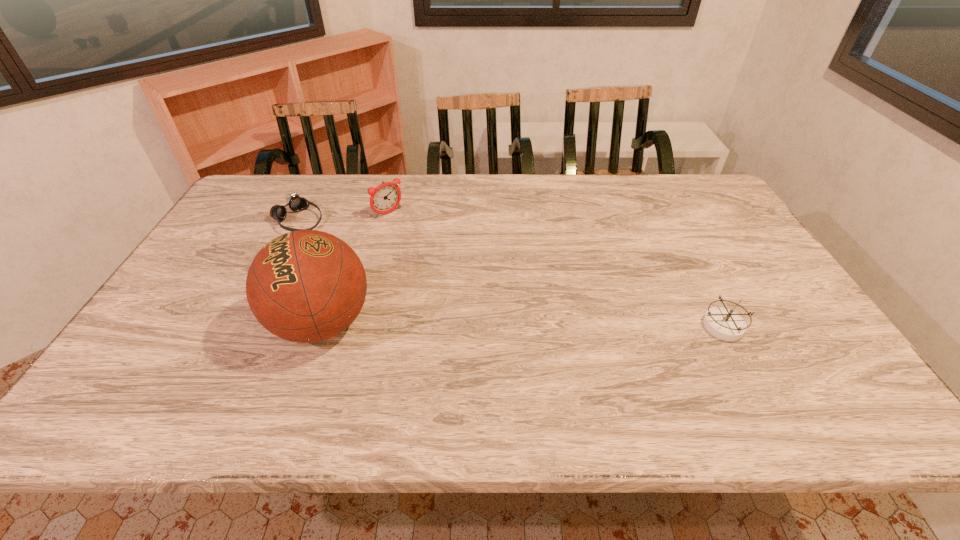
The image size is (960, 540). What are the coordinates of `the tallest object` in the screenshot? It's located at (305, 286).

Where is `compass`? compass is located at coordinates (724, 323).

Image resolution: width=960 pixels, height=540 pixels. Find the location of `the second tallest object`. the second tallest object is located at coordinates (384, 198).

Locate an element on the screen. This screenshot has height=540, width=960. goggles is located at coordinates (296, 203).

I want to click on free spot located on the right of the tallest object, so click(x=470, y=323).

This screenshot has height=540, width=960. I want to click on free space located 0.230m on the back of the compass, so click(684, 251).

Identify the location of free space located 0.380m on the front-facing side of the alarm clock. (467, 282).

At what (x,y) coordinates should I click in order to perform the action: click on free spot located on the front-facing side of the alarm clock. Please return your answer as a coordinate pair (x, y). Looking at the image, I should click on click(x=418, y=238).

The height and width of the screenshot is (540, 960). In order to click on vacant space situated 0.280m on the front-facing side of the alarm clock in this screenshot , I will do `click(446, 264)`.

You are a GUI agent. You are given a task and a screenshot of the screen. Output one action in this format:
    pyautogui.click(x=<x>, y=<y>)
    Task: Click on the vacant space located 0.200m through the lenses of the goggles
    The width and height of the screenshot is (960, 540).
    Given the screenshot: What is the action you would take?
    pyautogui.click(x=357, y=254)